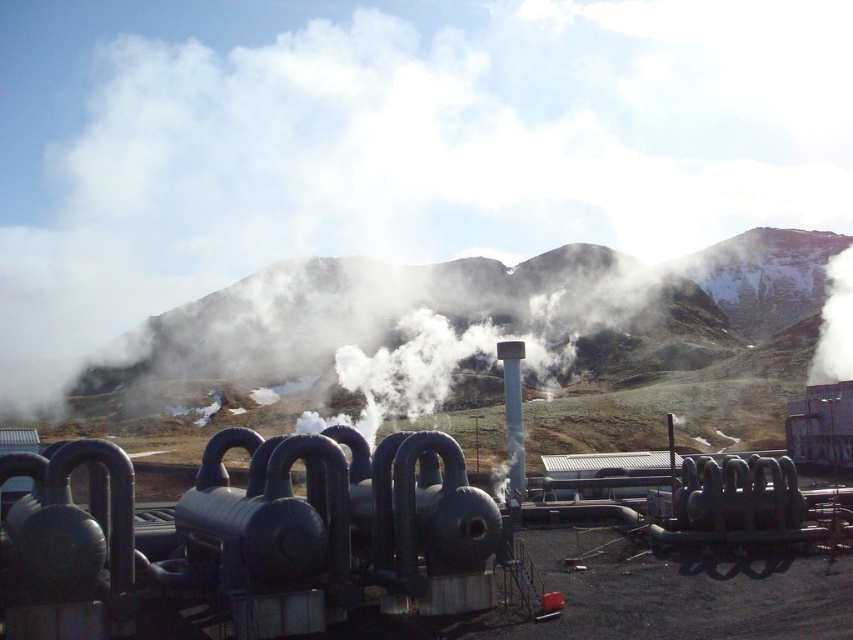
Question: Is the position of white smoke at center less distant than that of green grassy mountain at center?

Choices:
 (A) no
 (B) yes

Answer: (A)

Question: Which point is closer to the camera taking this photo?

Choices:
 (A) (786, 253)
 (B) (177, 12)

Answer: (A)

Question: Where is white smoke at center located in relation to green grassy mountain at center in the image?

Choices:
 (A) below
 (B) above

Answer: (B)

Question: Can you confirm if white smoke at center is thinner than green grassy mountain at center?

Choices:
 (A) no
 (B) yes

Answer: (A)